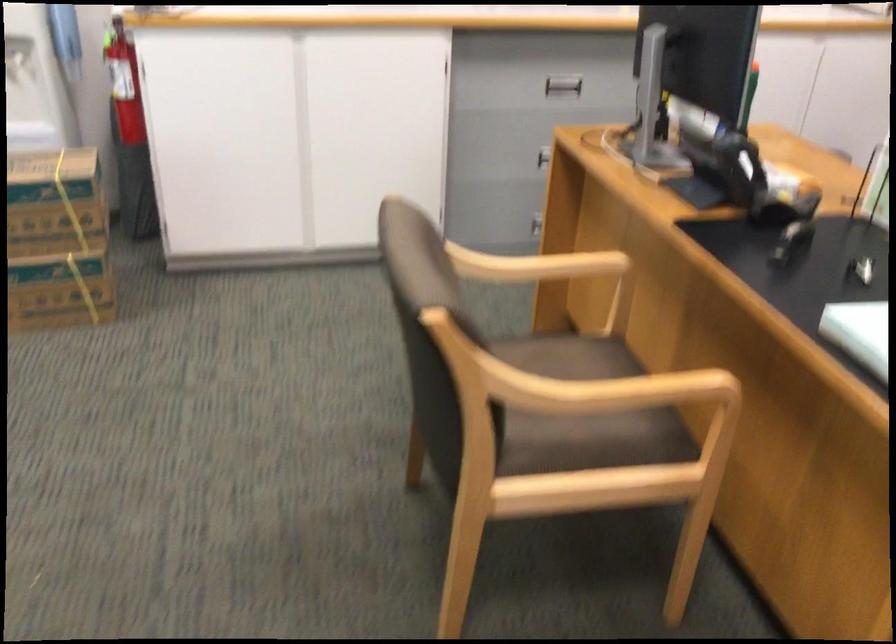
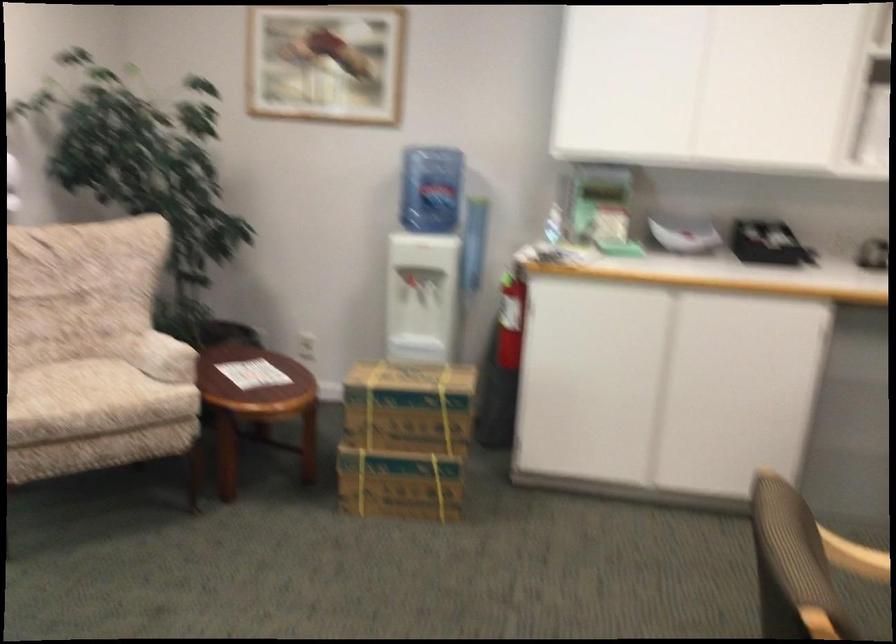
Where in the second image is the point corresponding to (x=495, y=256) from the first image?

(857, 529)